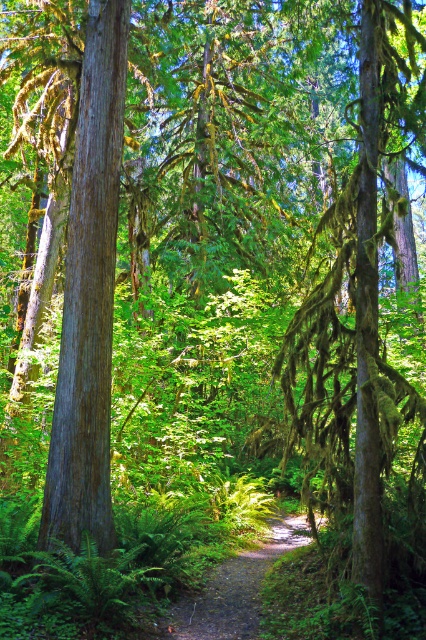
Question: Which of the following is the closest to the observer?

Choices:
 (A) dirt path at center
 (B) green mossy tree at center

Answer: (B)

Question: Is green mossy tree at center closer to the viewer compared to dirt path at center?

Choices:
 (A) no
 (B) yes

Answer: (B)

Question: Among these points, which one is nearest to the camera?

Choices:
 (A) (288, 609)
 (B) (256, 593)

Answer: (A)

Question: From the image, what is the correct spatial relationship of green mossy tree at center in relation to dirt path at center?

Choices:
 (A) above
 (B) below

Answer: (A)

Question: Does green mossy tree at center have a greater width compared to dirt path at center?

Choices:
 (A) no
 (B) yes

Answer: (B)